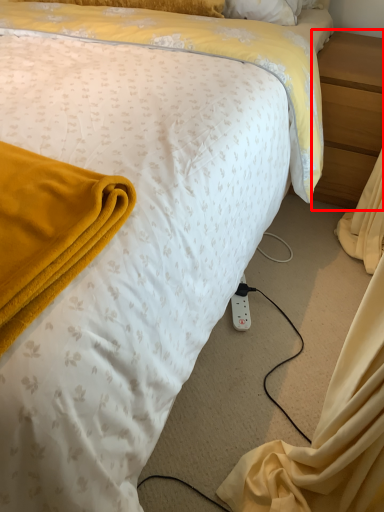
Question: From the image's perspective, what is the correct spatial relationship of nightstand (annotated by the red box) in relation to power outlet?

Choices:
 (A) above
 (B) below

Answer: (A)